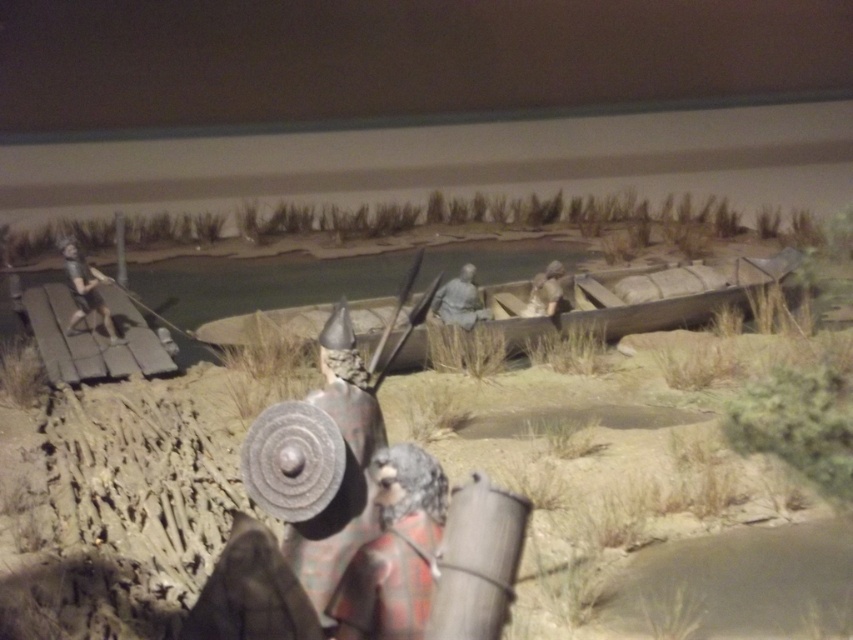
You are a traveler in this medieval scene who needs to cross the water. You see a wooden boat at center and a gray stone figure at center. Which object can you use to cross the water?

The wooden boat at center is bigger than gray stone figure at center, so you can use the wooden boat at center to cross the water.